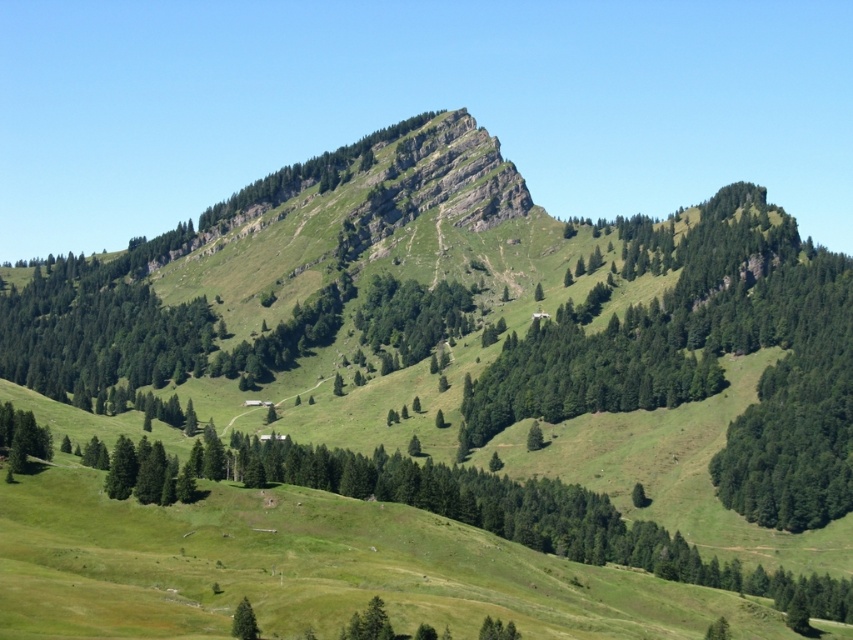
Does green textured tree at left appear on the right side of green matte tree at lower center?

Incorrect, green textured tree at left is not on the right side of green matte tree at lower center.

Can you confirm if green textured tree at left is smaller than green matte tree at lower center?

Actually, green textured tree at left might be larger than green matte tree at lower center.

Identify the location of green textured tree at left. (96, 333).

Locate an element on the screen. The height and width of the screenshot is (640, 853). green textured tree at left is located at coordinates (96, 333).

Can you confirm if green leafy tree at center is positioned to the left of green matte tree at lower center?

No, green leafy tree at center is not to the left of green matte tree at lower center.

Looking at this image, between green leafy tree at center and green matte tree at lower center, which one has more height?

With more height is green leafy tree at center.

Which is in front, point (426, 349) or point (242, 634)?

Point (242, 634) is in front.

I want to click on green leafy tree at center, so pos(410,316).

What do you see at coordinates (96, 333) in the screenshot? I see `green textured tree at left` at bounding box center [96, 333].

Where is `green textured tree at left`? The image size is (853, 640). green textured tree at left is located at coordinates (96, 333).